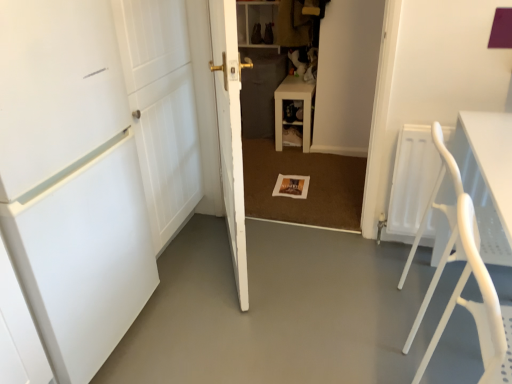
Question: Do you think wooden shelf at center is within white plastic folding chair at right, or outside of it?

Choices:
 (A) inside
 (B) outside

Answer: (B)

Question: Looking at their shapes, would you say wooden shelf at center is wider or thinner than white plastic folding chair at right?

Choices:
 (A) wide
 (B) thin

Answer: (B)

Question: Estimate the real-world distances between objects in this image. Which object is closer to the smooth concrete floor at center?

Choices:
 (A) white plastic folding chair at right
 (B) white matte door at left, the second door in the right-to-left sequence
 (C) wooden shelf at center
 (D) white matte door at center, the second door when ordered from left to right

Answer: (A)

Question: Which object is positioned farthest from the wooden shelf at center?

Choices:
 (A) smooth concrete floor at center
 (B) white matte door at center, the 1th door from the right
 (C) white matte door at left, the second door in the right-to-left sequence
 (D) white plastic folding chair at right

Answer: (C)